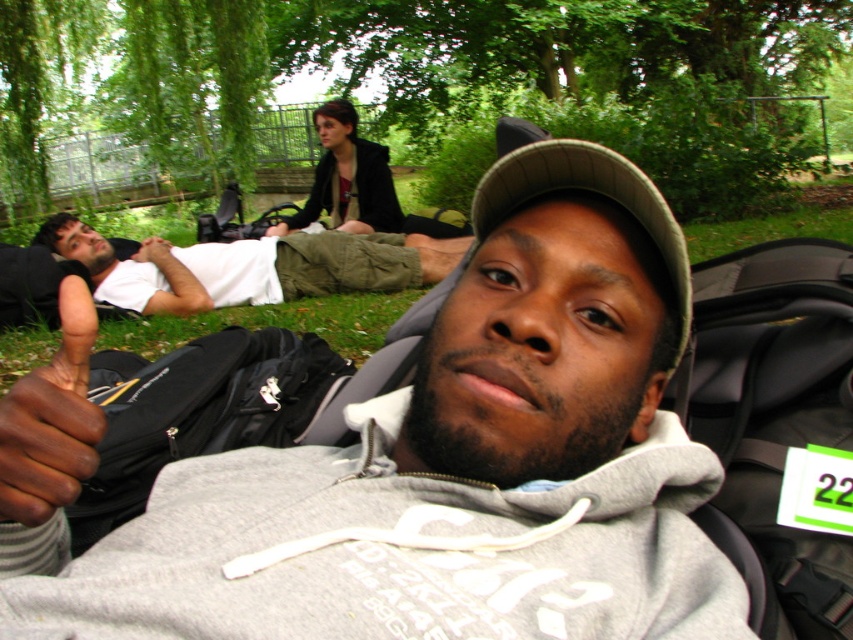
From the picture: You are a photographer trying to capture a photo of the gray hoodie at center and the white cotton shirt at left. Based on their positions, which object is closer to the camera?

The gray hoodie at center is closer to the camera because it is located below the white cotton shirt at left, indicating it is positioned lower in the frame and thus nearer to the viewer.

You are a photographer trying to capture a group photo of the gray hoodie at center and the white cotton shirt at left. Based on their sizes in the image, which one should you position closer to the camera to make them appear the same size?

The gray hoodie at center has a lesser width compared to the white cotton shirt at left, so to make them appear the same size in the photo, you should position the gray hoodie at center closer to the camera than the white cotton shirt at left.

You are a photographer standing at the edge of the park and want to take a photo of both the gray hoodie at center and the white cotton shirt at left. Given that your camera has a maximum focus range of 2.5 meters, can you capture both subjects clearly in the same frame?

The gray hoodie at center is 2.81 meters away from the white cotton shirt at left. Since the camera can only focus up to 2.5 meters, the distance between them exceeds the focus range. Therefore, you cannot capture both subjects clearly in the same frame.